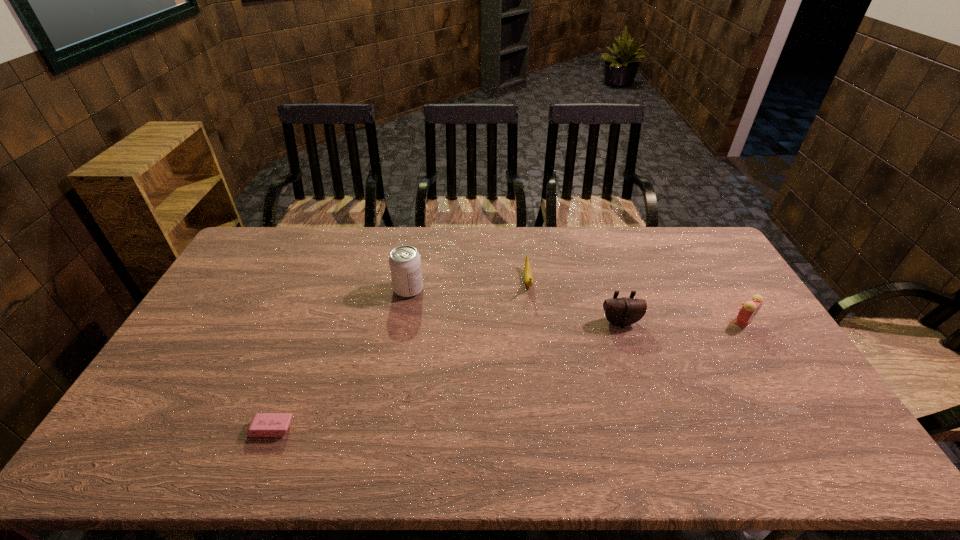
Image resolution: width=960 pixels, height=540 pixels. Identify the location of vacant area between the tallest object and the pouch. (515, 306).

Image resolution: width=960 pixels, height=540 pixels. In order to click on vacant space in between the fourth object from right to left and the banana in this screenshot , I will do `click(468, 285)`.

Find the location of a particular element. The height and width of the screenshot is (540, 960). object that is the second closest to the second object from left to right is located at coordinates (263, 424).

Identify which object is the third nearest to the pouch. Please provide its 2D coordinates. Your answer should be formatted as a tuple, i.e. [(x, y)], where the tuple contains the x and y coordinates of a point satisfying the conditions above.

[(405, 264)]

In order to click on vacant space that satisfies the following two spatial constraints: 1. on the back side of the leftmost object; 2. on the right side of the tallest object in this screenshot , I will do `click(325, 289)`.